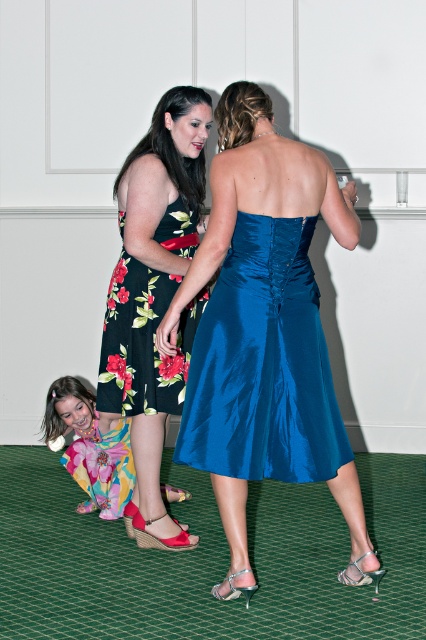
Who is lower down, floral satin dress at lower left or satin blue high-heeled sandal at lower center?

satin blue high-heeled sandal at lower center is lower down.

Looking at this image, does floral satin dress at lower left appear over satin blue high-heeled sandal at lower center?

Yes.

Image resolution: width=426 pixels, height=640 pixels. What are the coordinates of `floral satin dress at lower left` in the screenshot? It's located at (103, 467).

At what (x,y) coordinates should I click in order to perform the action: click on floral satin dress at lower left. Please return your answer as a coordinate pair (x, y). Looking at the image, I should click on (103, 467).

Does point (354, 563) come farther from viewer compared to point (252, 588)?

Yes, point (354, 563) is behind point (252, 588).

Can you confirm if satin blue high-heeled sandal at lower center is positioned below clear plastic high-heeled sandal at lower center?

Incorrect, satin blue high-heeled sandal at lower center is not positioned below clear plastic high-heeled sandal at lower center.

Is point (339, 579) positioned before point (216, 589)?

No, (339, 579) is behind (216, 589).

Where is `satin blue high-heeled sandal at lower center`? satin blue high-heeled sandal at lower center is located at coordinates (362, 573).

Does shiny blue dress at center come behind shiny pink sandal at lower left?

No, shiny blue dress at center is closer to the viewer.

Who is positioned more to the left, shiny blue dress at center or shiny pink sandal at lower left?

From the viewer's perspective, shiny pink sandal at lower left appears more on the left side.

Does point (302, 240) come closer to viewer compared to point (147, 540)?

Yes, point (302, 240) is in front of point (147, 540).

Where is `shiny blue dress at center`? The height and width of the screenshot is (640, 426). shiny blue dress at center is located at coordinates (262, 364).